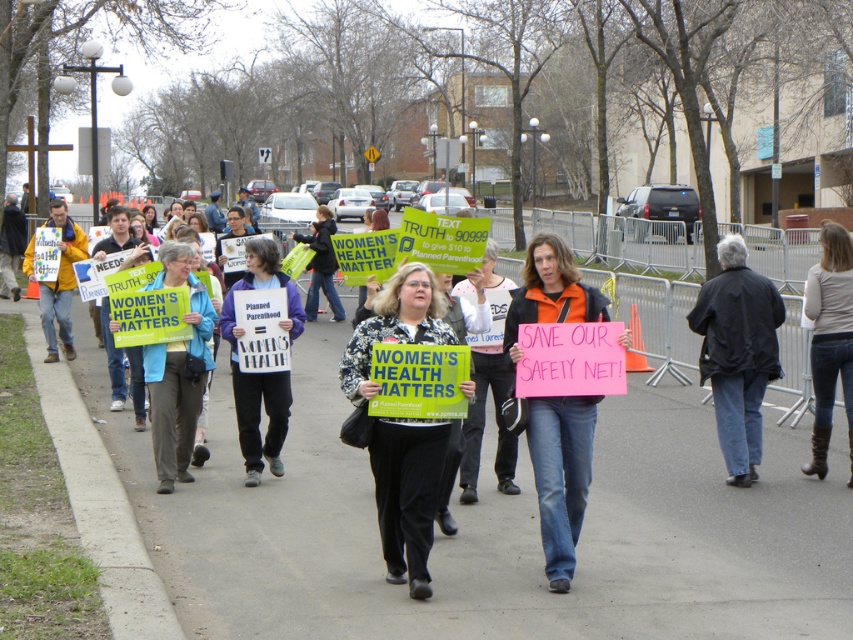
Measure the distance between black textured coat at center and camera.

7.65 meters

Who is shorter, black textured coat at center or green fabric sign at left?

black textured coat at center is shorter.

Who is more forward, (380, 512) or (157, 436)?

Point (380, 512)

The height and width of the screenshot is (640, 853). Identify the location of black textured coat at center. (407, 493).

Is black textured coat at center to the left of pink fabric sign at center from the viewer's perspective?

Yes, black textured coat at center is to the left of pink fabric sign at center.

Describe the element at coordinates (407, 493) in the screenshot. This screenshot has height=640, width=853. I see `black textured coat at center` at that location.

Find the location of `black textured coat at center`. black textured coat at center is located at coordinates (407, 493).

Between point (851, 480) and point (503, 396), which one is positioned in front?

Positioned in front is point (503, 396).

Can you confirm if denim jeans at lower right is positioned to the right of matte black jacket at center?

Yes, denim jeans at lower right is to the right of matte black jacket at center.

Is point (825, 388) less distant than point (495, 464)?

No, it is not.

I want to click on denim jeans at lower right, so click(x=830, y=339).